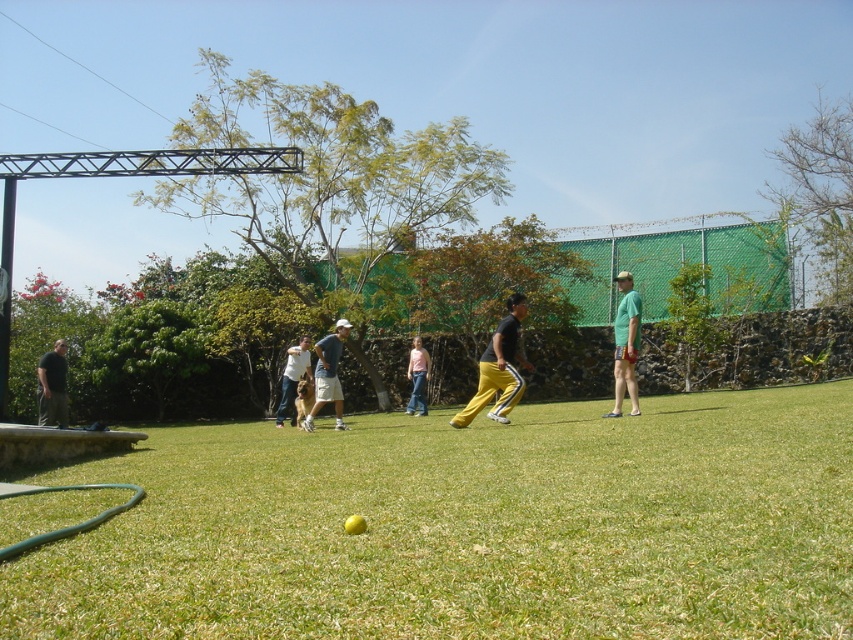
Question: Does black matte pants at center have a lesser width compared to dark gray shirt at left?

Choices:
 (A) yes
 (B) no

Answer: (B)

Question: Which of the following is the closest to the observer?

Choices:
 (A) green grass at center
 (B) dark gray shirt at left
 (C) tan cotton shorts at center
 (D) black matte pants at center

Answer: (A)

Question: Can you confirm if green grass at center is smaller than green matte shirt at center?

Choices:
 (A) no
 (B) yes

Answer: (B)

Question: Based on their relative distances, which object is nearer to the black matte pants at center?

Choices:
 (A) green matte shirt at center
 (B) tan cotton shorts at center
 (C) green grass at center
 (D) dark gray shirt at left

Answer: (A)

Question: Which of the following is the farthest from the observer?

Choices:
 (A) (276, 426)
 (B) (622, 324)
 (C) (57, 374)
 (D) (550, 598)

Answer: (A)

Question: Can you confirm if green matte shirt at center is positioned below tan cotton shorts at center?

Choices:
 (A) no
 (B) yes

Answer: (A)